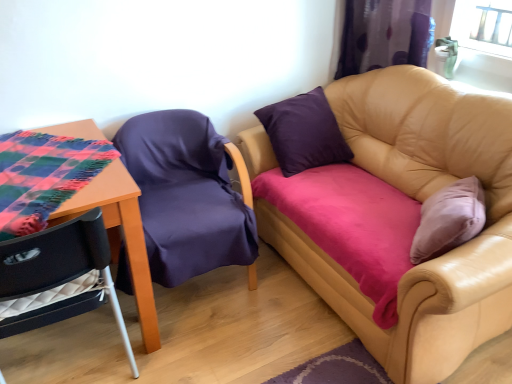
Question: Is velvet purple chair at lower left, arranged as the 2th chair when viewed from the right, to the left of purple fabric curtain at upper right from the viewer's perspective?

Choices:
 (A) no
 (B) yes

Answer: (B)

Question: Is velvet purple chair at lower left, which ranks as the 1th chair in left-to-right order, turned away from purple fabric curtain at upper right?

Choices:
 (A) no
 (B) yes

Answer: (A)

Question: From the image's perspective, is velvet purple chair at lower left, arranged as the 2th chair when viewed from the right, on purple fabric curtain at upper right?

Choices:
 (A) no
 (B) yes

Answer: (A)

Question: Does velvet purple chair at lower left, arranged as the 2th chair when viewed from the right, have a smaller size compared to purple fabric curtain at upper right?

Choices:
 (A) yes
 (B) no

Answer: (B)

Question: Would you consider velvet purple chair at lower left, which ranks as the 1th chair in left-to-right order, to be distant from purple fabric curtain at upper right?

Choices:
 (A) yes
 (B) no

Answer: (A)

Question: Is velvet purple chair at lower left, which ranks as the 1th chair in left-to-right order, positioned in front of purple fabric curtain at upper right?

Choices:
 (A) yes
 (B) no

Answer: (A)

Question: Is purple fabric chair at left, the second chair in the left-to-right sequence, positioned before tan leather couch at upper right?

Choices:
 (A) yes
 (B) no

Answer: (B)

Question: Can we say purple fabric chair at left, the second chair in the left-to-right sequence, lies outside tan leather couch at upper right?

Choices:
 (A) no
 (B) yes

Answer: (B)

Question: From a real-world perspective, is purple fabric chair at left, the second chair in the left-to-right sequence, physically above tan leather couch at upper right?

Choices:
 (A) yes
 (B) no

Answer: (B)

Question: Considering the relative positions of purple fabric chair at left, the first chair viewed from the right, and tan leather couch at upper right in the image provided, is purple fabric chair at left, the first chair viewed from the right, behind tan leather couch at upper right?

Choices:
 (A) yes
 (B) no

Answer: (A)

Question: Does purple fabric chair at left, the second chair in the left-to-right sequence, have a lesser height compared to tan leather couch at upper right?

Choices:
 (A) no
 (B) yes

Answer: (B)

Question: Considering the relative sizes of purple fabric chair at left, the first chair viewed from the right, and tan leather couch at upper right in the image provided, is purple fabric chair at left, the first chair viewed from the right, bigger than tan leather couch at upper right?

Choices:
 (A) yes
 (B) no

Answer: (B)

Question: Is tan leather couch at upper right oriented away from plaid fabric-covered table at left?

Choices:
 (A) yes
 (B) no

Answer: (B)